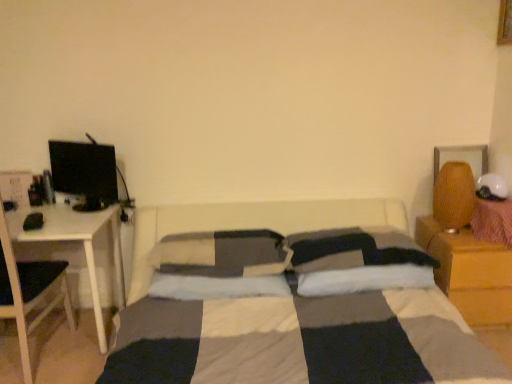
Question: From a real-world perspective, relative to black glossy computer monitor at left, is white glossy table at left vertically above or below?

Choices:
 (A) below
 (B) above

Answer: (A)

Question: Is white glossy table at left spatially inside black glossy computer monitor at left, or outside of it?

Choices:
 (A) inside
 (B) outside

Answer: (B)

Question: Which is farther from the white glossy table at left?

Choices:
 (A) black glossy computer monitor at left
 (B) white soft pillow at center, which is the 1th pillow in left-to-right order
 (C) wooden nightstand at right
 (D) white soft pillow at center, the first pillow when ordered from right to left
 (E) textured brown lampshade at right

Answer: (C)

Question: Considering the real-world distances, which object is farthest from the soft gray pillow at center, marked as the second pillow in a right-to-left arrangement?

Choices:
 (A) white soft pillow at center, which is the 1th pillow in left-to-right order
 (B) black glossy computer monitor at left
 (C) textured brown lampshade at right
 (D) white glossy table at left
 (E) white soft pillow at center, the first pillow when ordered from right to left

Answer: (C)